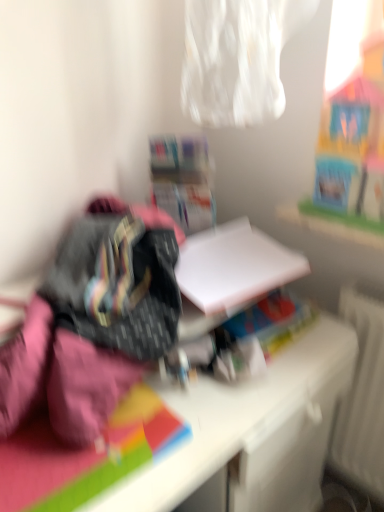
Question: From the image's perspective, is white matte desk at center positioned above or below white cardboard box at center?

Choices:
 (A) above
 (B) below

Answer: (B)

Question: In the image, is white matte desk at center positioned in front of or behind white cardboard box at center?

Choices:
 (A) behind
 (B) front

Answer: (B)

Question: Considering the real-world distances, which object is farthest from the white cardboard box at center?

Choices:
 (A) white matte desk at center
 (B) white matte paper at center

Answer: (A)

Question: Which object is the farthest from the white cardboard box at center?

Choices:
 (A) white matte desk at center
 (B) white matte paper at center

Answer: (A)